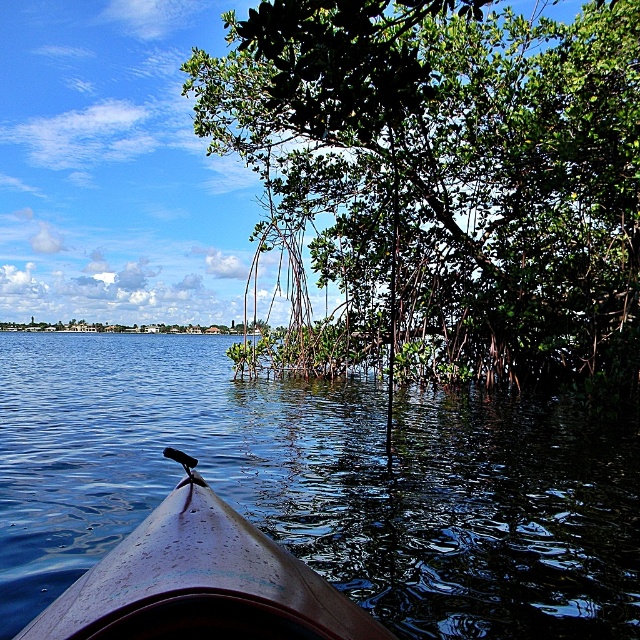
Is point (330, 209) positioned in front of point (150, 428)?

No, it is not.

Does green leafy tree at upper right have a lesser height compared to blue glossy water at center?

No.

Is point (493, 243) positioned before point (212, 419)?

That is False.

Identify the location of green leafy tree at upper right. The width and height of the screenshot is (640, 640). (451, 177).

Is point (113, 445) closer to camera compared to point (323, 634)?

No, (113, 445) is behind (323, 634).

Does blue glossy water at center have a greater height compared to brown matte kayak at lower left?

Yes, blue glossy water at center is taller than brown matte kayak at lower left.

Between point (372, 592) and point (250, 618), which one is positioned in front?

Point (250, 618) is in front.

Where is `blue glossy water at center`? The image size is (640, 640). blue glossy water at center is located at coordinates (323, 484).

Which of these two, green leafy tree at upper right or brown matte kayak at lower left, stands taller?

green leafy tree at upper right is taller.

Is green leafy tree at upper right further to the viewer compared to brown matte kayak at lower left?

Yes.

Between point (632, 381) and point (221, 540), which one is positioned behind?

The point (632, 381) is more distant.

At what (x,y) coordinates should I click in order to perform the action: click on green leafy tree at upper right. Please return your answer as a coordinate pair (x, y). Looking at the image, I should click on (451, 177).